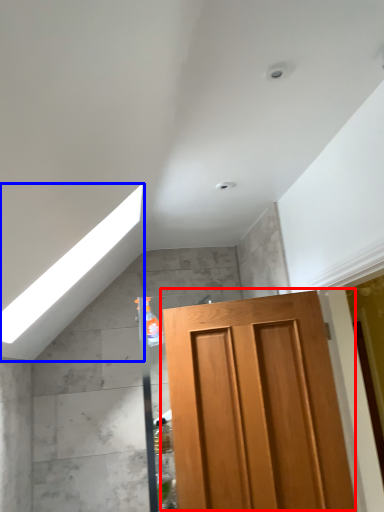
Question: Among these objects, which one is nearest to the camera, door (highlighted by a red box) or exhaust hood (highlighted by a blue box)?

Choices:
 (A) door
 (B) exhaust hood

Answer: (B)